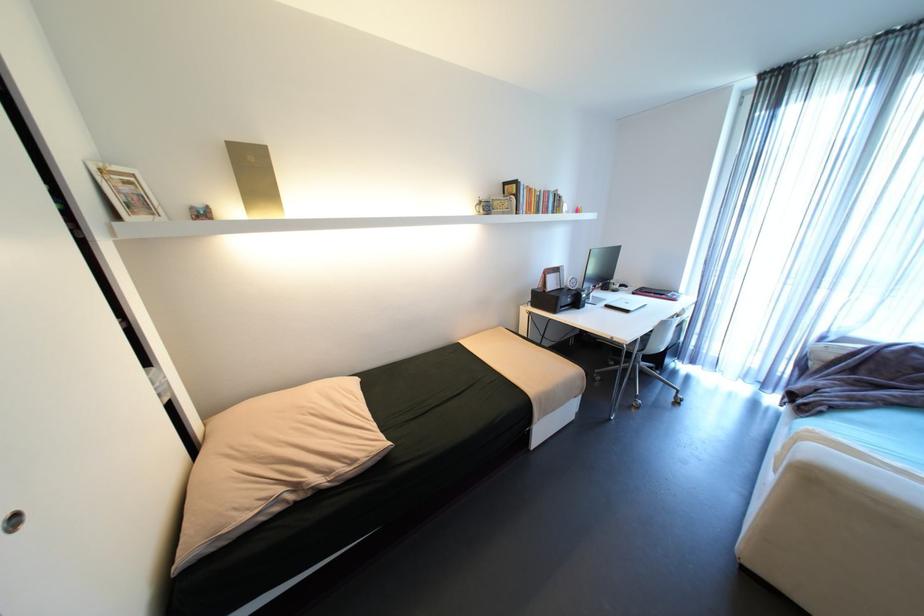
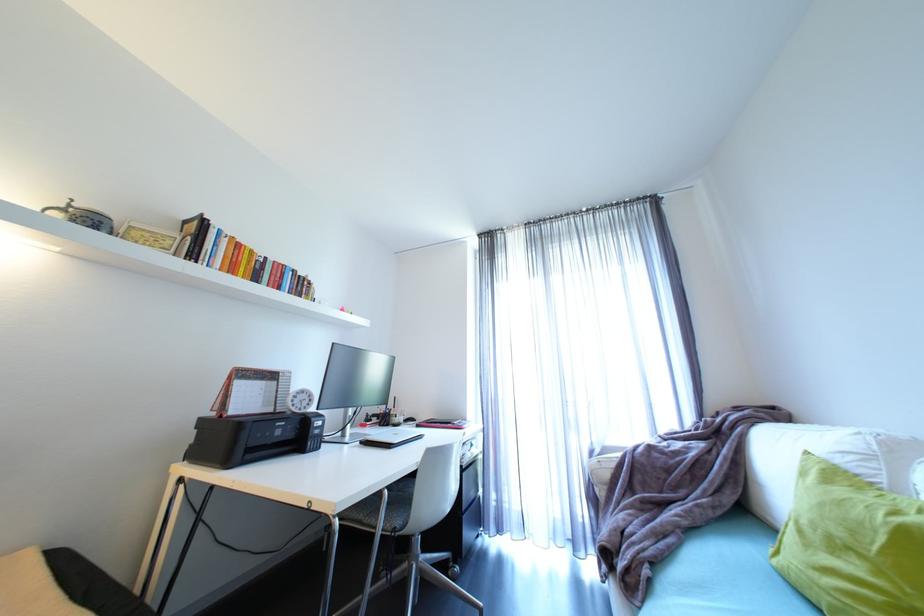
Locate, in the second image, the point that corresponds to [653,294] in the first image.

(440, 424)